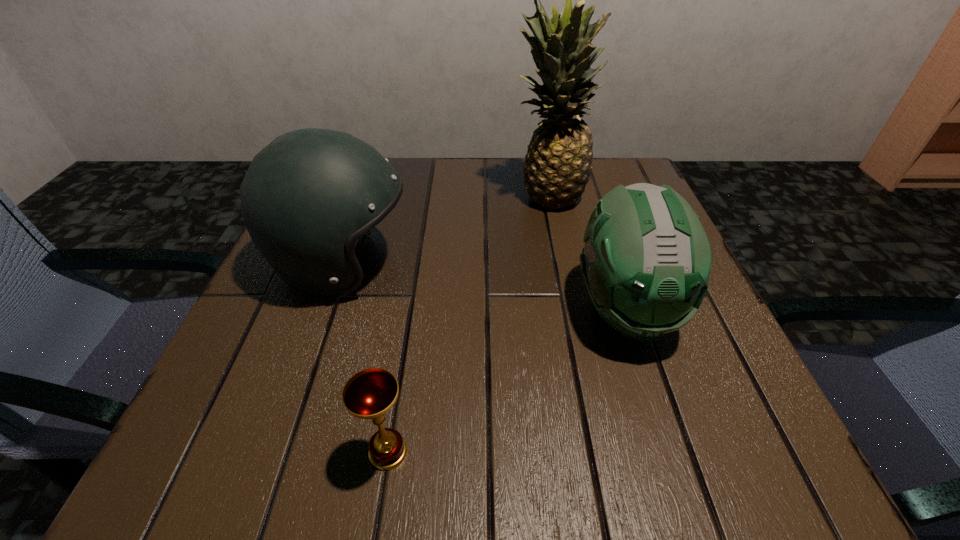
This screenshot has height=540, width=960. What are the coordinates of `pineapple` in the screenshot? It's located at (558, 163).

At what (x,y) coordinates should I click in order to perform the action: click on the tallest object. Please return your answer as a coordinate pair (x, y). Looking at the image, I should click on (558, 163).

Image resolution: width=960 pixels, height=540 pixels. What are the coordinates of `the taller football helmet` in the screenshot? It's located at (306, 197).

Locate an element on the screen. This screenshot has height=540, width=960. the third shortest object is located at coordinates (306, 197).

Locate an element on the screen. the shorter football helmet is located at coordinates (646, 262).

Identify the location of the second shortest object. The image size is (960, 540). (646, 262).

You are a GUI agent. You are given a task and a screenshot of the screen. Output one action in this format:
    pyautogui.click(x=<x>, y=<y>)
    Task: Click on the nearest object
    This screenshot has height=540, width=960.
    Given the screenshot: What is the action you would take?
    pyautogui.click(x=370, y=393)

What are the coordinates of `chalice` in the screenshot? It's located at (370, 393).

The width and height of the screenshot is (960, 540). Identify the location of free space located 0.140m on the left of the tallest object. (448, 197).

Where is `blank area located at the face opening of the taller football helmet`? This screenshot has height=540, width=960. blank area located at the face opening of the taller football helmet is located at coordinates (498, 264).